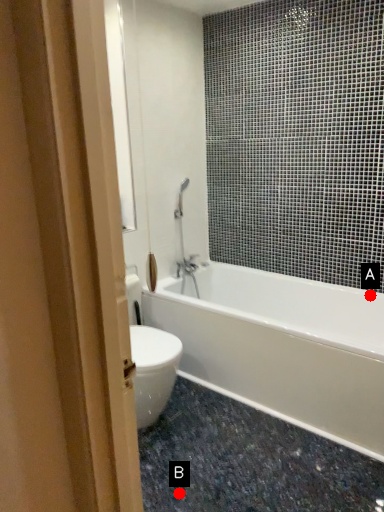
Question: Two points are circled on the image, labeled by A and B beside each circle. Which point is closer to the camera?

Choices:
 (A) A is closer
 (B) B is closer

Answer: (B)